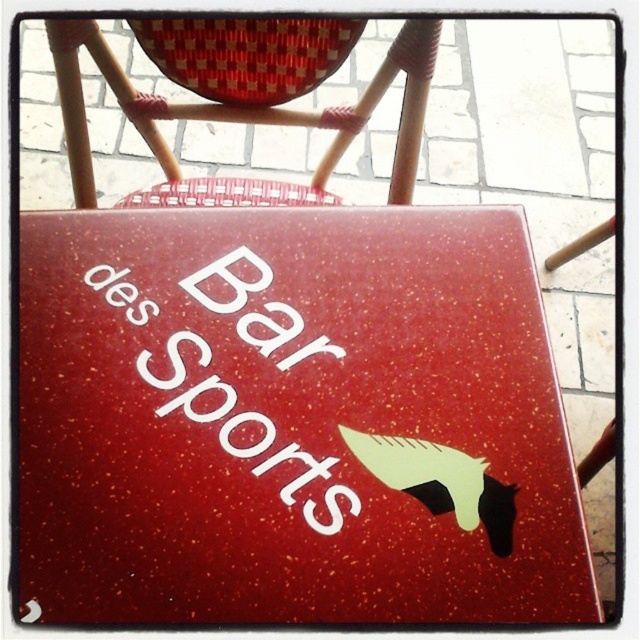
Looking at this image, you are sitting in a chair at the table and want to place a napkin on the surface. Which object should you use, the glossy speckled table at center or the white speckled paper at center?

The glossy speckled table at center is located below the white speckled paper at center, so you should use the glossy speckled table at center to place the napkin since it is the lower surface.

You are sitting at the table and want to place a small notebook on the white speckled paper at center. To do this, do you need to move the woven rattan chair at upper left out of the way?

The woven rattan chair at upper left is further to the viewer than the white speckled paper at center, so the chair is closer to you. Therefore, you would need to move the woven rattan chair at upper left to access the white speckled paper at center.

You are sitting at the red table with the horse silhouette and want to place a small notebook on the surface. The notebook needs to be placed between the woven rattan chair at upper left and the white speckled paper at center. Can you fit the notebook there?

The woven rattan chair at upper left has a lesser height compared to white speckled paper at center, so the notebook can be placed between them as there is enough vertical space between the two objects.